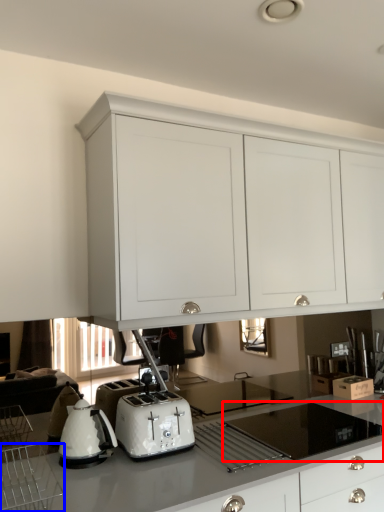
Question: Which point is further to the camera, gas stove (highlighted by a red box) or kitchen appliance (highlighted by a blue box)?

Choices:
 (A) gas stove
 (B) kitchen appliance

Answer: (A)